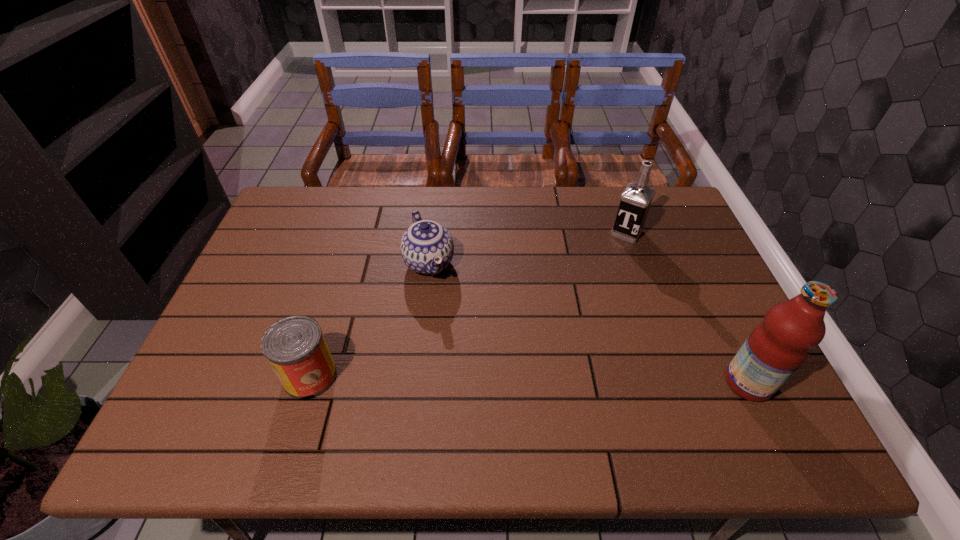
Find the location of a particular element. The height and width of the screenshot is (540, 960). free space that satisfies the following two spatial constraints: 1. on the front side of the vodka; 2. on the front label of the tallest object is located at coordinates (680, 383).